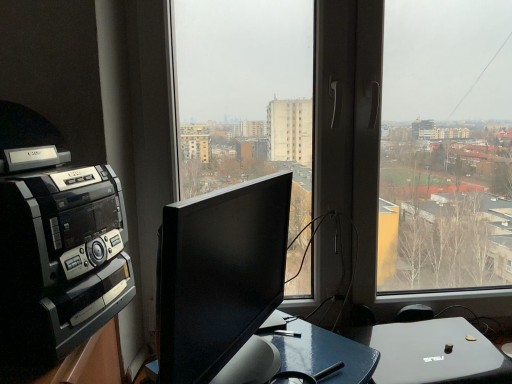
Question: Does black plastic amplifier at left turn towards black glossy monitor at center?

Choices:
 (A) no
 (B) yes

Answer: (B)

Question: Is black plastic amplifier at left touching black glossy monitor at center?

Choices:
 (A) yes
 (B) no

Answer: (B)

Question: Does black plastic amplifier at left have a lesser width compared to black glossy monitor at center?

Choices:
 (A) no
 (B) yes

Answer: (A)

Question: Would you say black plastic amplifier at left contains black glossy monitor at center?

Choices:
 (A) no
 (B) yes

Answer: (A)

Question: Can you confirm if black plastic amplifier at left is shorter than black glossy monitor at center?

Choices:
 (A) no
 (B) yes

Answer: (A)

Question: From a real-world perspective, is black plastic amplifier at left physically located above or below transparent glass window at center?

Choices:
 (A) below
 (B) above

Answer: (A)

Question: Does point (74, 182) appear closer or farther from the camera than point (443, 167)?

Choices:
 (A) closer
 (B) farther

Answer: (A)

Question: Looking at their shapes, would you say black plastic amplifier at left is wider or thinner than transparent glass window at center?

Choices:
 (A) wide
 (B) thin

Answer: (A)

Question: Is black plastic amplifier at left in front of or behind transparent glass window at center in the image?

Choices:
 (A) behind
 (B) front

Answer: (B)

Question: From a real-world perspective, is black glossy monitor at center above or below transparent glass window at center?

Choices:
 (A) above
 (B) below

Answer: (B)

Question: From the image's perspective, relative to transparent glass window at center, is black glossy monitor at center above or below?

Choices:
 (A) above
 (B) below

Answer: (B)

Question: Is black glossy monitor at center in front of or behind transparent glass window at center in the image?

Choices:
 (A) behind
 (B) front

Answer: (B)

Question: Considering the positions of point (203, 198) and point (256, 165), is point (203, 198) closer or farther from the camera than point (256, 165)?

Choices:
 (A) farther
 (B) closer

Answer: (B)

Question: In terms of height, does transparent glass window at center look taller or shorter compared to black glossy monitor at center?

Choices:
 (A) short
 (B) tall

Answer: (B)

Question: Is transparent glass window at center to the left or to the right of black glossy monitor at center in the image?

Choices:
 (A) left
 (B) right

Answer: (B)